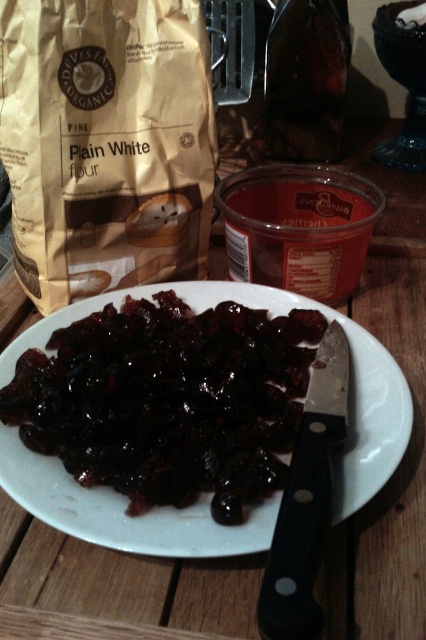
Question: Is brown paper bag at upper left to the left of shiny dark brown raisins at center from the viewer's perspective?

Choices:
 (A) no
 (B) yes

Answer: (B)

Question: Does brown paper bag at upper left appear over shiny dark brown raisins at center?

Choices:
 (A) no
 (B) yes

Answer: (B)

Question: Which point appears farthest from the camera in this image?

Choices:
 (A) (132, 284)
 (B) (143, 419)

Answer: (A)

Question: In this image, where is brown paper bag at upper left located relative to shiny dark brown raisins at center?

Choices:
 (A) right
 (B) left

Answer: (B)